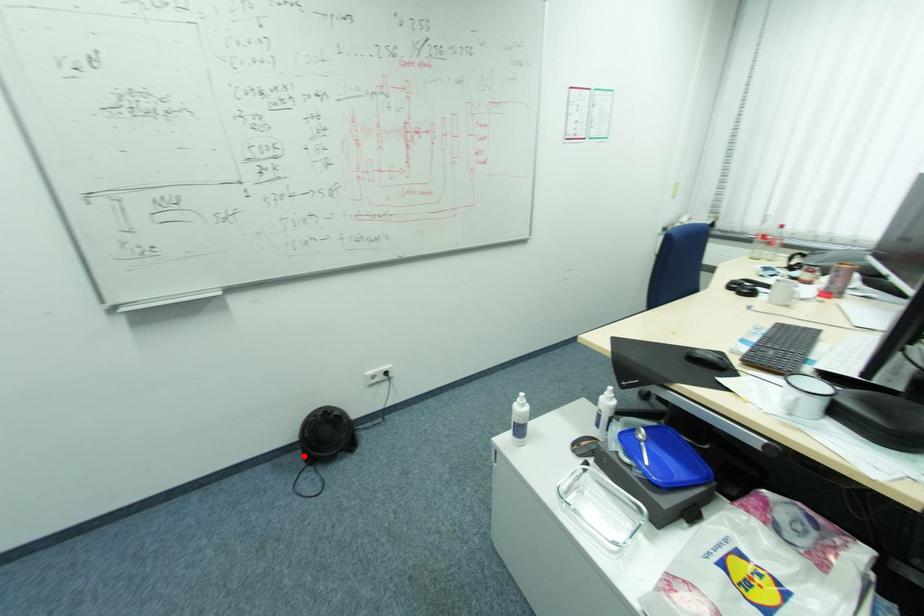
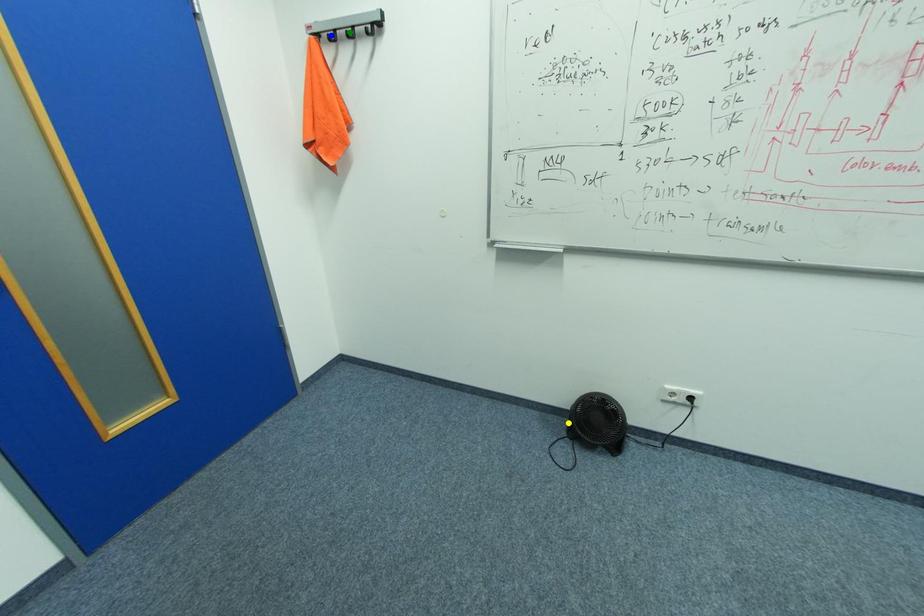
Question: I am providing you with two images of the same scene from different viewpoints. A red point is marked on the first image. You are given multiple points on the second image. Which point in image 2 is actually the same real-world point as the red point in image 1?

Choices:
 (A) blue point
 (B) green point
 (C) yellow point

Answer: (C)